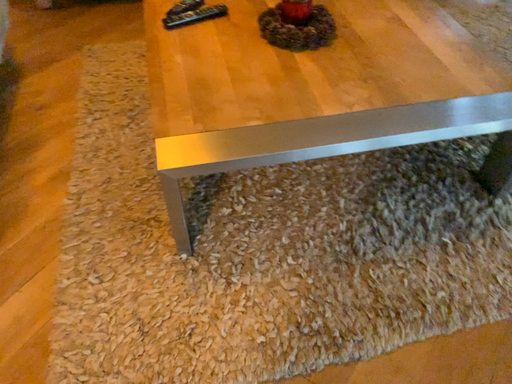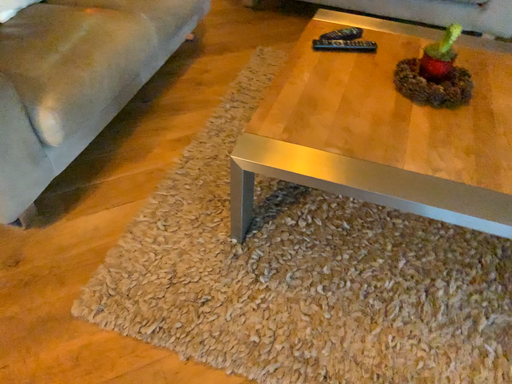
Question: How did the camera likely rotate when shooting the video?

Choices:
 (A) rotated left
 (B) rotated right

Answer: (A)